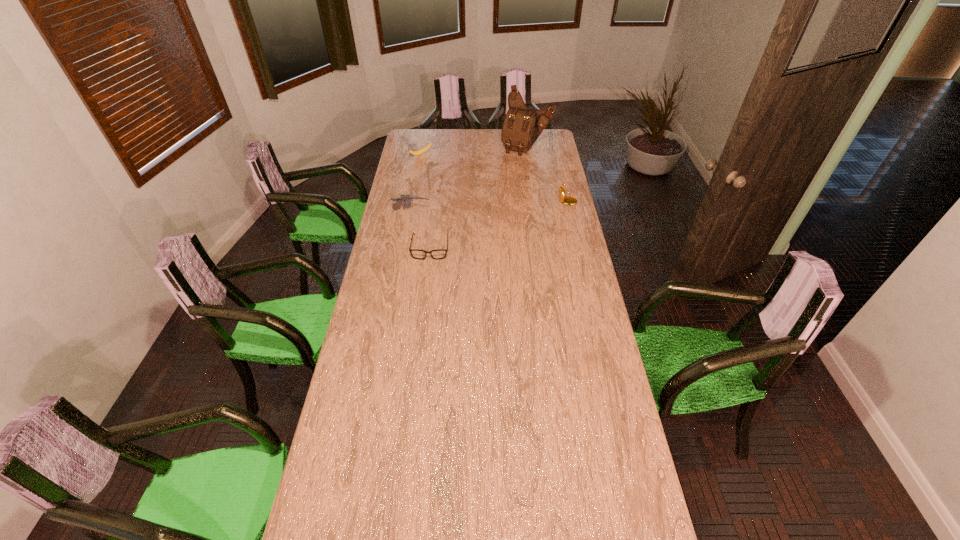
Identify the location of shoulder bag that is positioned at the right edge. (522, 126).

Locate an element on the screen. Image resolution: width=960 pixels, height=540 pixels. object that is at the far right corner is located at coordinates (522, 126).

Locate an element on the screen. Image resolution: width=960 pixels, height=540 pixels. vacant space at the far edge of the desktop is located at coordinates pos(478,146).

The height and width of the screenshot is (540, 960). In order to click on free space at the near edge of the desktop in this screenshot , I will do `click(374, 501)`.

Where is `free space at the left edge of the desktop`? Image resolution: width=960 pixels, height=540 pixels. free space at the left edge of the desktop is located at coordinates (358, 384).

In the image, there is a desktop. Where is `free space at the right edge`? This screenshot has height=540, width=960. free space at the right edge is located at coordinates (545, 186).

Identify the location of vacant point at the far left corner. (422, 137).

The width and height of the screenshot is (960, 540). In the image, there is a desktop. What are the coordinates of `free space at the near left corner` in the screenshot? It's located at (329, 488).

Locate an element on the screen. free space between the shoulder bag and the gun is located at coordinates (468, 180).

Find the location of a particular element. Image resolution: width=960 pixels, height=540 pixels. vacant space that's between the pocket watch and the second nearest object is located at coordinates (489, 206).